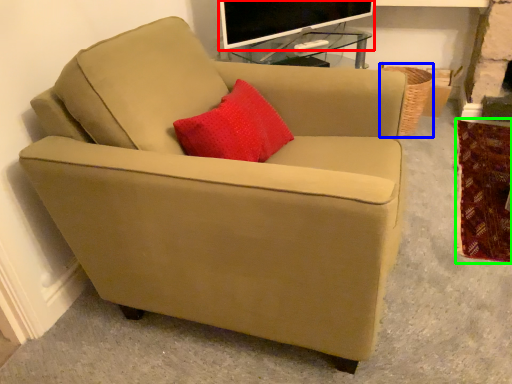
Question: Based on their relative distances, which object is farther from television (highlighted by a red box)? Choose from basket (highlighted by a blue box) and blanket (highlighted by a green box).

Choices:
 (A) basket
 (B) blanket

Answer: (B)